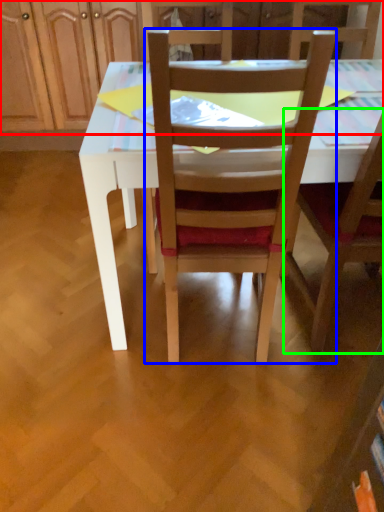
Question: Considering the real-world distances, which object is farthest from dresser (highlighted by a red box)? chair (highlighted by a blue box) or chair (highlighted by a green box)?

Choices:
 (A) chair
 (B) chair

Answer: (B)